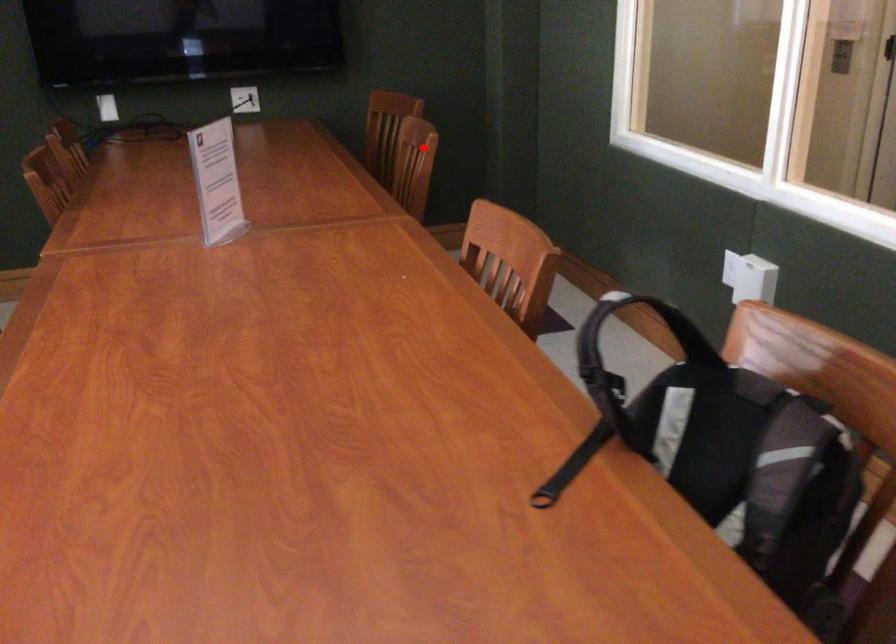
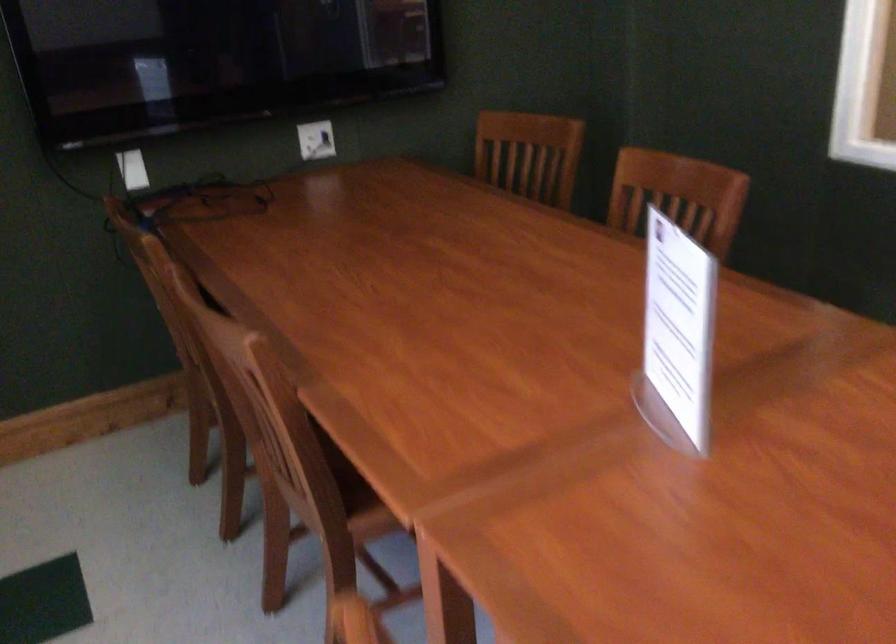
Question: I am providing you with two images of the same scene from different viewpoints. Given a red point in image1, look at the same physical point in image2. Is it:

Choices:
 (A) Closer to the viewpoint
 (B) Farther from the viewpoint

Answer: (A)